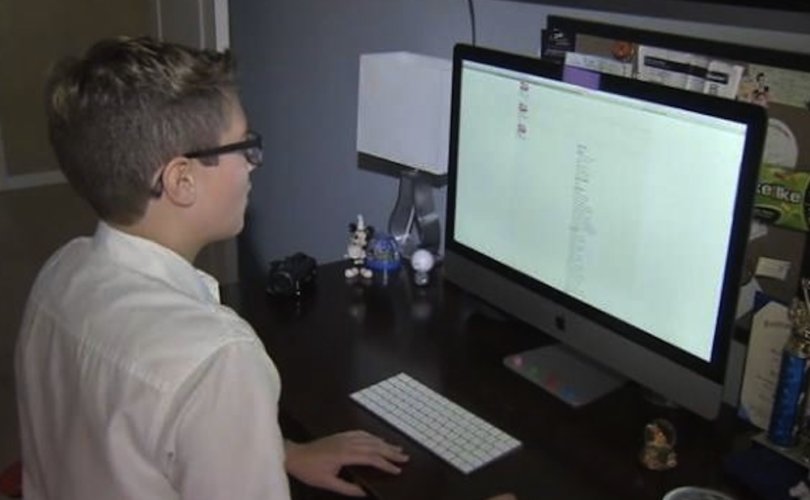
Where is `keyboard`? This screenshot has width=810, height=500. keyboard is located at coordinates (432, 429).